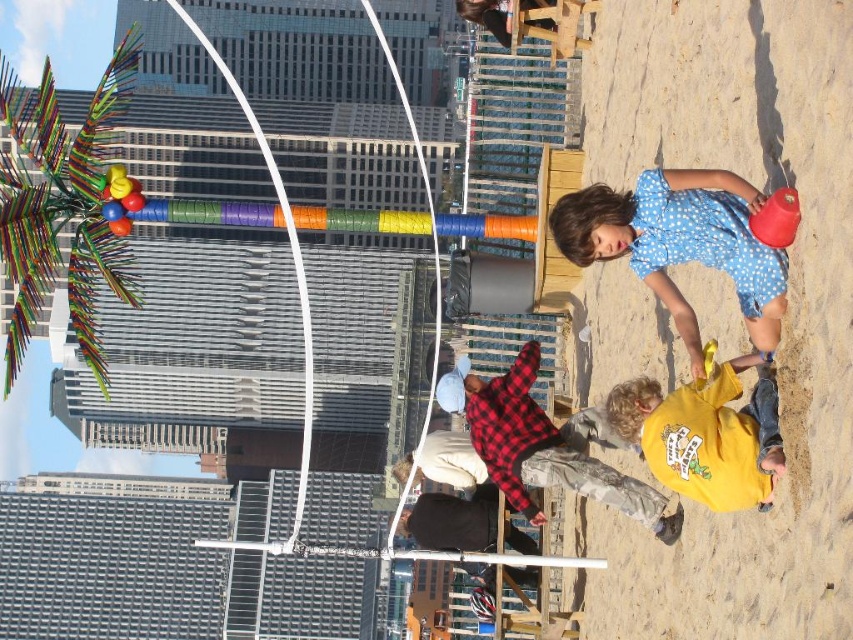
You are a parent trying to locate your child wearing a yellow cotton shirt at lower center and another child wearing a red plaid shirt at center in the beach playground. Based on the image, which child is positioned higher up in the scene?

The yellow cotton shirt at lower center is above the red plaid shirt at center, so the child wearing the yellow cotton shirt at lower center is positioned higher up in the scene.

You are a parent trying to locate your two children in the beach playground. You see the yellow cotton shirt at lower center and the red plaid shirt at center. Which child is standing to the right of the other?

The yellow cotton shirt at lower center is positioned on the right side of red plaid shirt at center, so the child in the yellow cotton shirt at lower center is to the right of the child in the red plaid shirt at center.

You are standing at the origin point of the coordinate system in the image. You want to move towards the yellow cotton shirt at lower center. What are the coordinates you should aim for?

The coordinates you should aim for are 0.681 in the x direction and 0.828 in the y direction.